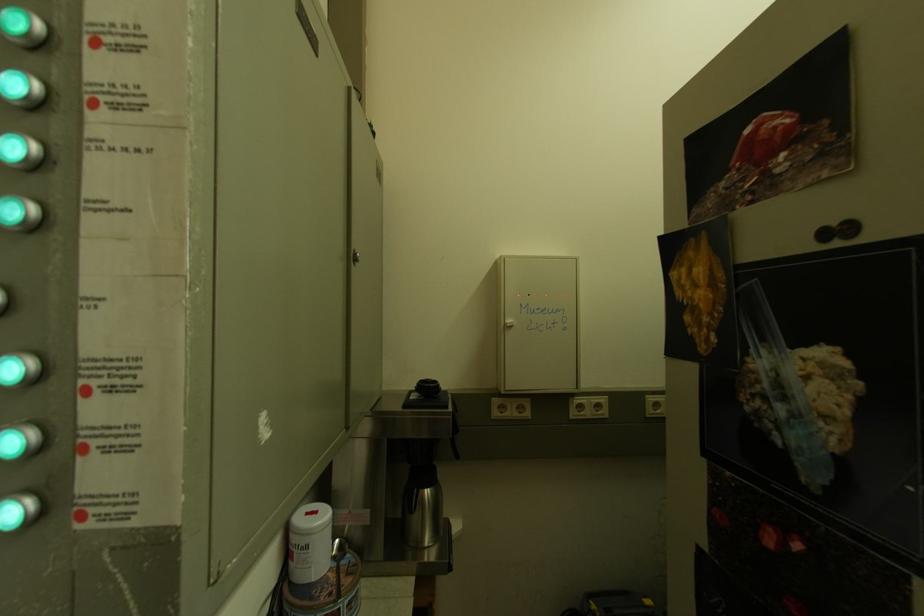
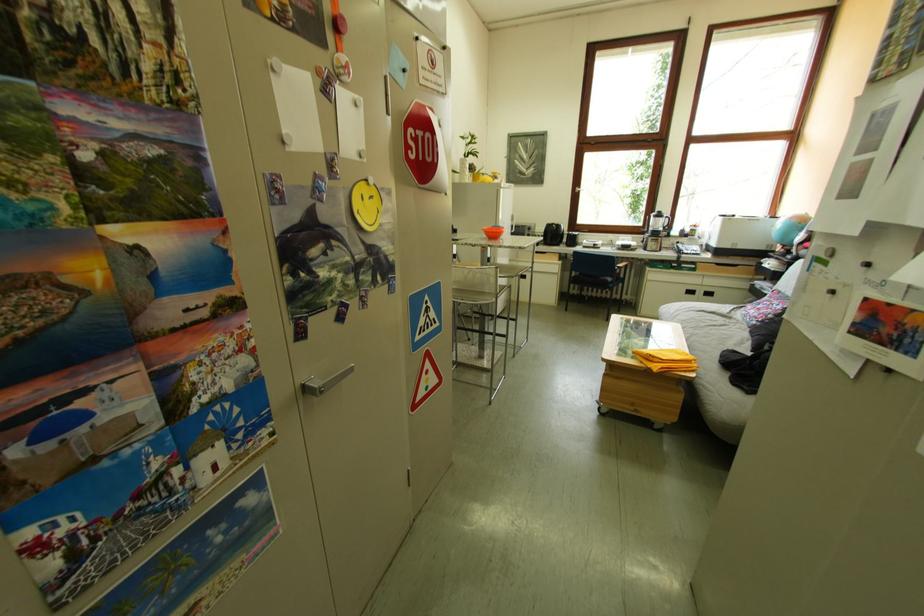
The first image is from the beginning of the video and the second image is from the end. How did the camera likely rotate when shooting the video?

The camera rotated toward right-down.